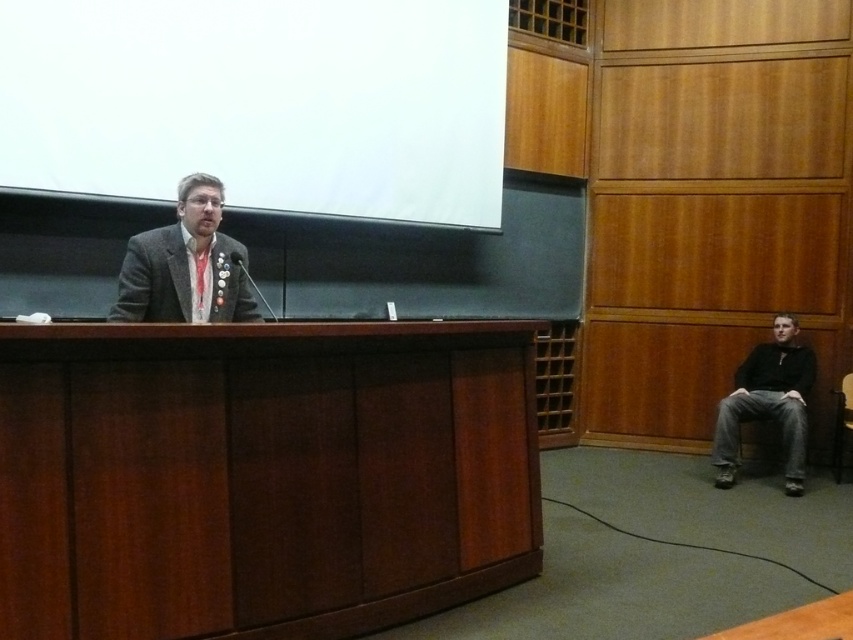
Is point (387, 49) behind point (746, 413)?

No, (387, 49) is in front of (746, 413).

Does white matte projection screen at upper center have a greater height compared to black matte jacket at lower right?

Yes.

Between point (210, 35) and point (778, 332), which one is positioned in front?

Point (210, 35) is in front.

The height and width of the screenshot is (640, 853). What are the coordinates of `white matte projection screen at upper center` in the screenshot? It's located at (260, 102).

Is white matte projection screen at upper center shorter than matte gray suit at center?

No.

Who is shorter, white matte projection screen at upper center or matte gray suit at center?

matte gray suit at center is shorter.

In order to click on white matte projection screen at upper center in this screenshot , I will do `click(260, 102)`.

Who is lower down, brown wood table at center or wooden chair at right?

Positioned lower is wooden chair at right.

Is brown wood table at center behind wooden chair at right?

No, it is not.

Is point (331, 326) in front of point (843, 376)?

Yes, point (331, 326) is in front of point (843, 376).

Locate an element on the screen. The height and width of the screenshot is (640, 853). brown wood table at center is located at coordinates (260, 476).